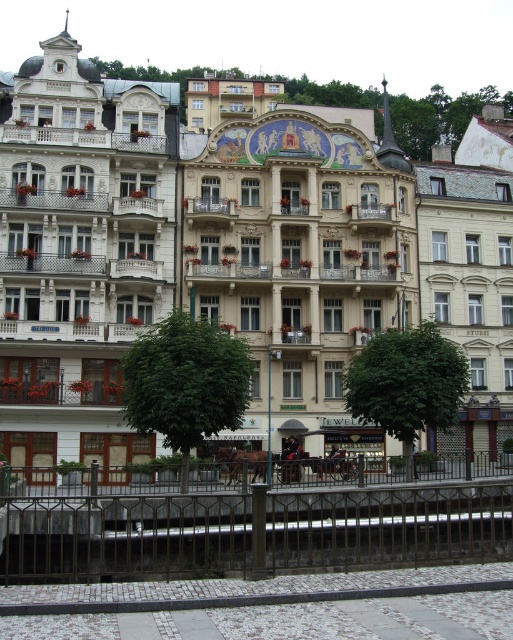
You are an architect planning to install a new decorative element on the building. You have two options for placement based on the existing white painted wood balcony at upper center and the white wrought iron balcony at center. Which balcony offers more horizontal space for the decoration?

The white painted wood balcony at upper center offers more horizontal space for the decoration since its width surpasses that of the white wrought iron balcony at center.

Looking at this image, you are standing at the entrance of the European building and want to locate the white painted wood balcony at upper center. According to the coordinates provided, where should you look to find it?

The white painted wood balcony at upper center is located at coordinates point (84, 138).

You are standing in front of the European building and see a point marked at coordinates (84, 138). Based on the scene description, can you determine what surface this point is located on?

The point is located on the white painted wood balcony at upper center.